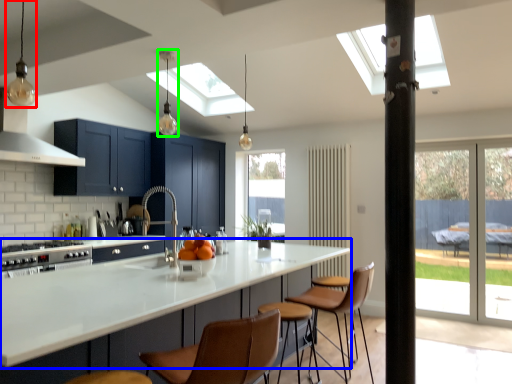
Question: Based on their relative distances, which object is nearer to light fixture (highlighted by a red box)? Choose from countertop (highlighted by a blue box) and light fixture (highlighted by a green box).

Choices:
 (A) countertop
 (B) light fixture

Answer: (A)